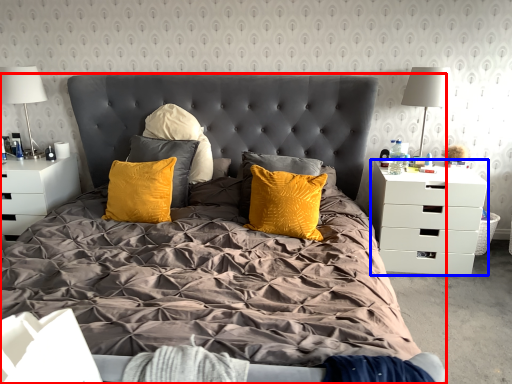
Question: Which object appears closest to the camera in this image, bed (highlighted by a red box) or nightstand (highlighted by a blue box)?

Choices:
 (A) bed
 (B) nightstand

Answer: (A)